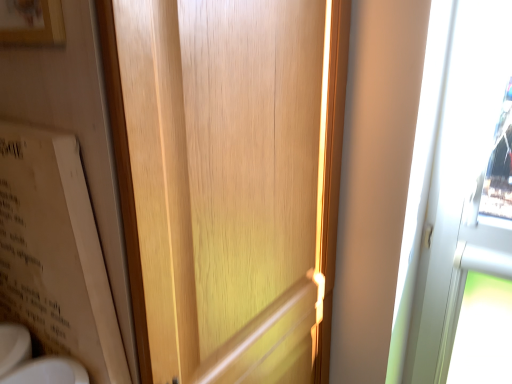
Question: From a real-world perspective, is wooden picture frame at upper left physically below wooden door at center?

Choices:
 (A) no
 (B) yes

Answer: (A)

Question: Is wooden picture frame at upper left positioned behind wooden door at center?

Choices:
 (A) no
 (B) yes

Answer: (B)

Question: From a real-world perspective, is wooden picture frame at upper left positioned over wooden door at center based on gravity?

Choices:
 (A) yes
 (B) no

Answer: (A)

Question: Is wooden picture frame at upper left facing away from wooden door at center?

Choices:
 (A) no
 (B) yes

Answer: (B)

Question: Is wooden door at center inside wooden picture frame at upper left?

Choices:
 (A) yes
 (B) no

Answer: (B)

Question: In the image, is wooden door at center positioned in front of or behind beige cardboard bulletin board at left?

Choices:
 (A) front
 (B) behind

Answer: (A)

Question: From the image's perspective, is wooden door at center positioned above or below beige cardboard bulletin board at left?

Choices:
 (A) below
 (B) above

Answer: (A)

Question: Considering the positions of point [x=233, y=66] and point [x=104, y=340], is point [x=233, y=66] closer or farther from the camera than point [x=104, y=340]?

Choices:
 (A) farther
 (B) closer

Answer: (A)

Question: From a real-world perspective, is wooden door at center physically located above or below beige cardboard bulletin board at left?

Choices:
 (A) below
 (B) above

Answer: (A)

Question: Visually, is white glossy sink at lower left positioned to the left or to the right of beige cardboard bulletin board at left?

Choices:
 (A) right
 (B) left

Answer: (A)

Question: Is white glossy sink at lower left inside or outside of beige cardboard bulletin board at left?

Choices:
 (A) inside
 (B) outside

Answer: (B)

Question: In terms of height, does white glossy sink at lower left look taller or shorter compared to beige cardboard bulletin board at left?

Choices:
 (A) short
 (B) tall

Answer: (A)

Question: Looking at the image, does white glossy sink at lower left seem bigger or smaller compared to beige cardboard bulletin board at left?

Choices:
 (A) small
 (B) big

Answer: (A)

Question: From the image's perspective, relative to white glossy sink at lower left, is wooden door at center above or below?

Choices:
 (A) above
 (B) below

Answer: (A)

Question: Is point (326, 11) closer or farther from the camera than point (46, 365)?

Choices:
 (A) closer
 (B) farther

Answer: (B)